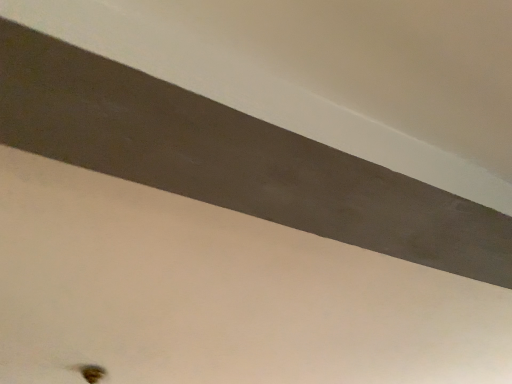
What do you see at coordinates (232, 159) in the screenshot? The height and width of the screenshot is (384, 512). I see `matte gray knife at upper center` at bounding box center [232, 159].

In order to face matte gray knife at upper center, should I rotate leftwards or rightwards?

A 13.277 degree turn to the right will do.

Locate an element on the screen. Image resolution: width=512 pixels, height=384 pixels. matte gray knife at upper center is located at coordinates (232, 159).

I want to click on matte gray knife at upper center, so click(x=232, y=159).